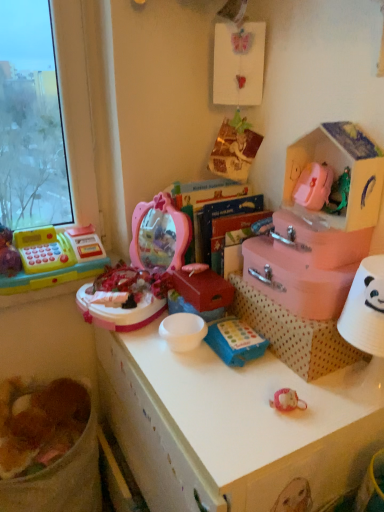
The width and height of the screenshot is (384, 512). What are the coordinates of `unoccupied area in front of matte pink box at center, marked as the 1th box in a left-to-right arrangement` in the screenshot? It's located at (207, 368).